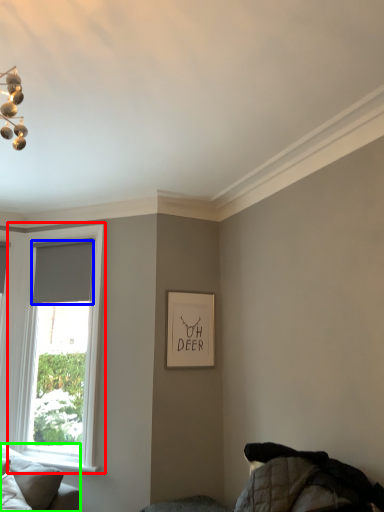
Question: Which object is the closest to the window (highlighted by a red box)? Choose among these: curtain (highlighted by a blue box) or studio couch (highlighted by a green box).

Choices:
 (A) curtain
 (B) studio couch

Answer: (A)